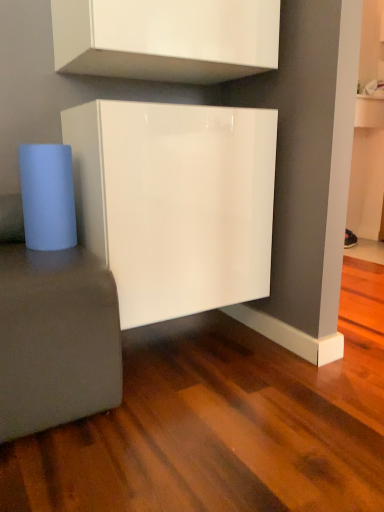
Question: From the image's perspective, would you say glossy white cabinet at center, the second cabinetry in the top-to-bottom sequence, is positioned over glossy white cabinet at upper center, which appears as the first cabinetry when viewed from the top?

Choices:
 (A) no
 (B) yes

Answer: (A)

Question: Does glossy white cabinet at center, which is the 1th cabinetry from bottom to top, appear on the left side of glossy white cabinet at upper center, which appears as the 2th cabinetry when ordered from the bottom?

Choices:
 (A) no
 (B) yes

Answer: (A)

Question: Is glossy white cabinet at center, which is the 1th cabinetry from bottom to top, not within glossy white cabinet at upper center, which appears as the 2th cabinetry when ordered from the bottom?

Choices:
 (A) yes
 (B) no

Answer: (A)

Question: Does glossy white cabinet at center, the second cabinetry in the top-to-bottom sequence, appear on the right side of glossy white cabinet at upper center, which appears as the 2th cabinetry when ordered from the bottom?

Choices:
 (A) yes
 (B) no

Answer: (A)

Question: From a real-world perspective, is glossy white cabinet at center, which is the 1th cabinetry from bottom to top, located beneath glossy white cabinet at upper center, which appears as the 2th cabinetry when ordered from the bottom?

Choices:
 (A) yes
 (B) no

Answer: (A)

Question: From a real-world perspective, relative to matte gray side table at lower left, is glossy white cabinet at center, the second cabinetry in the top-to-bottom sequence, vertically above or below?

Choices:
 (A) below
 (B) above

Answer: (B)

Question: Looking at their shapes, would you say glossy white cabinet at center, which is the 1th cabinetry from bottom to top, is wider or thinner than matte gray side table at lower left?

Choices:
 (A) thin
 (B) wide

Answer: (A)

Question: Is glossy white cabinet at center, which is the 1th cabinetry from bottom to top, in front of or behind matte gray side table at lower left in the image?

Choices:
 (A) behind
 (B) front

Answer: (A)

Question: From the image's perspective, is glossy white cabinet at center, the second cabinetry in the top-to-bottom sequence, located above or below matte gray side table at lower left?

Choices:
 (A) above
 (B) below

Answer: (A)

Question: From their relative heights in the image, would you say glossy white cabinet at upper center, which appears as the first cabinetry when viewed from the top, is taller or shorter than glossy white cabinet at center, the second cabinetry in the top-to-bottom sequence?

Choices:
 (A) tall
 (B) short

Answer: (B)

Question: Which is correct: glossy white cabinet at upper center, which appears as the 2th cabinetry when ordered from the bottom, is inside glossy white cabinet at center, the second cabinetry in the top-to-bottom sequence, or outside of it?

Choices:
 (A) outside
 (B) inside

Answer: (A)

Question: From the image's perspective, is glossy white cabinet at upper center, which appears as the 2th cabinetry when ordered from the bottom, located above or below glossy white cabinet at center, the second cabinetry in the top-to-bottom sequence?

Choices:
 (A) above
 (B) below

Answer: (A)

Question: In terms of width, does glossy white cabinet at upper center, which appears as the first cabinetry when viewed from the top, look wider or thinner when compared to glossy white cabinet at center, the second cabinetry in the top-to-bottom sequence?

Choices:
 (A) wide
 (B) thin

Answer: (B)

Question: From the image's perspective, is glossy white cabinet at center, the second cabinetry in the top-to-bottom sequence, positioned above or below glossy white cabinet at upper center, which appears as the first cabinetry when viewed from the top?

Choices:
 (A) above
 (B) below

Answer: (B)

Question: Is glossy white cabinet at center, the second cabinetry in the top-to-bottom sequence, bigger or smaller than glossy white cabinet at upper center, which appears as the first cabinetry when viewed from the top?

Choices:
 (A) big
 (B) small

Answer: (A)